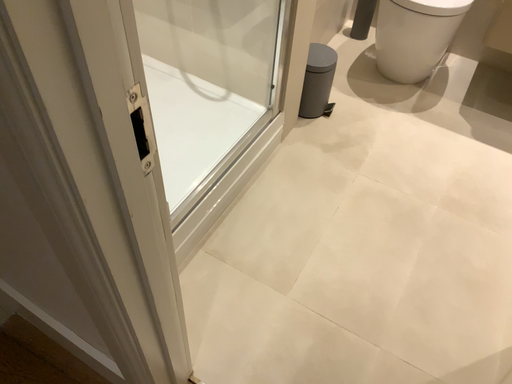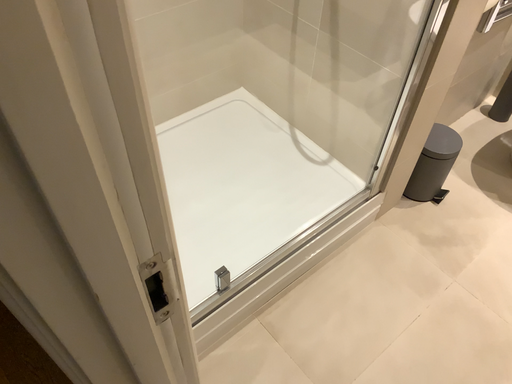
Question: How did the camera likely rotate when shooting the video?

Choices:
 (A) rotated right
 (B) rotated left

Answer: (B)